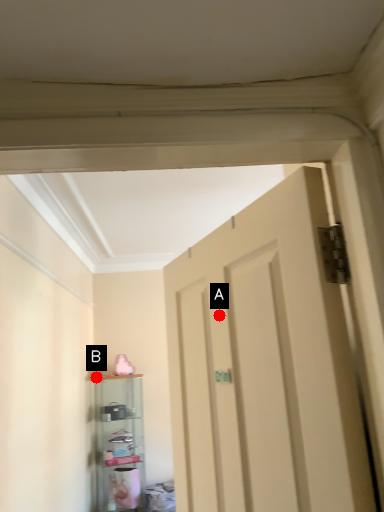
Question: Two points are circled on the image, labeled by A and B beside each circle. Which point is further to the camera?

Choices:
 (A) A is further
 (B) B is further

Answer: (B)